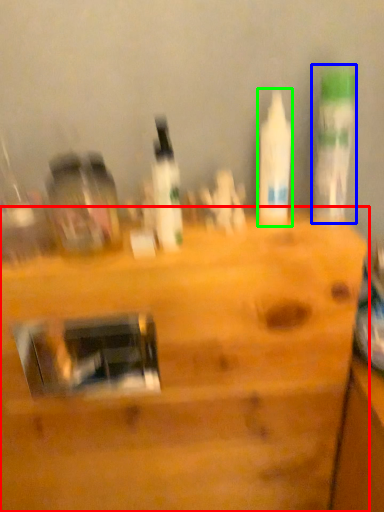
Question: Which object is the farthest from furniture (highlighted by a red box)? Choose among these: bottle (highlighted by a blue box) or bottle (highlighted by a green box).

Choices:
 (A) bottle
 (B) bottle

Answer: (A)